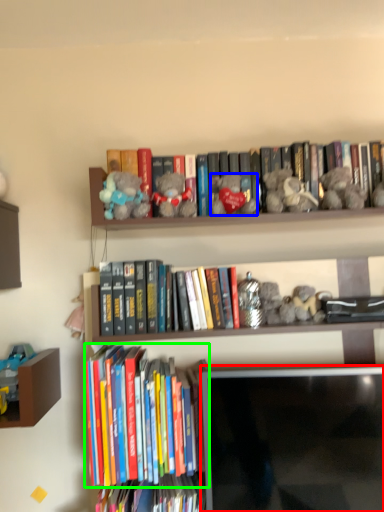
Question: Which object is the closest to the computer monitor (highlighted by a red box)? Choose among these: toy (highlighted by a blue box) or book (highlighted by a green box).

Choices:
 (A) toy
 (B) book

Answer: (B)